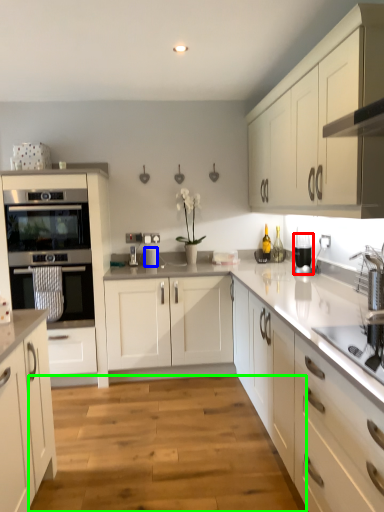
Question: Which is farther away from kitchen appliance (highlighted by a red box)? appliance (highlighted by a blue box) or plain (highlighted by a green box)?

Choices:
 (A) appliance
 (B) plain

Answer: (B)